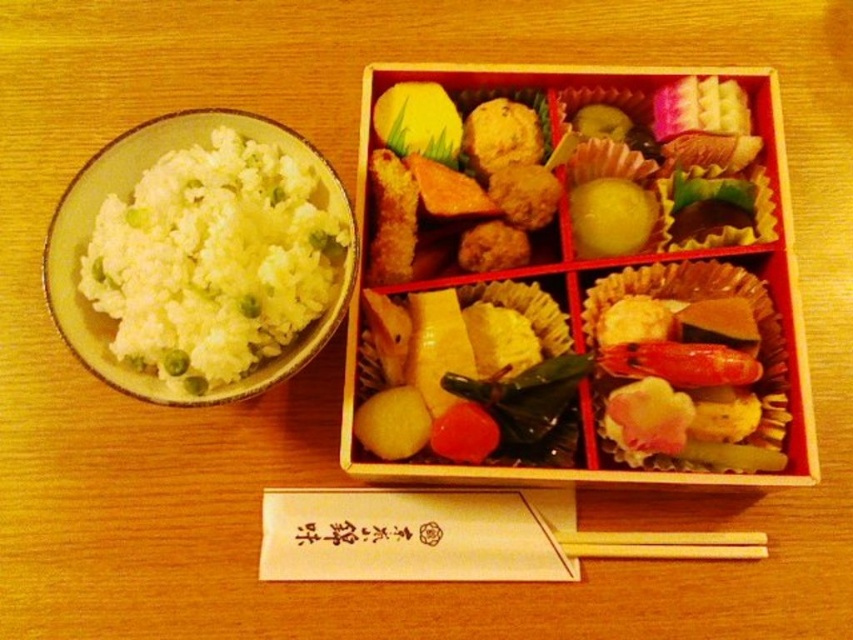
Between shiny golden rice ball at center and white matte rice at left, which one is positioned lower?

shiny golden rice ball at center

Can you confirm if shiny golden rice ball at center is positioned to the left of white matte rice at left?

Incorrect, shiny golden rice ball at center is not on the left side of white matte rice at left.

Locate an element on the screen. shiny golden rice ball at center is located at coordinates (577, 273).

Does point (514, 120) come closer to viewer compared to point (677, 531)?

That is False.

Measure the distance between shiny golden rice ball at center and camera.

shiny golden rice ball at center is 37.48 inches away from camera.

Between point (367, 176) and point (564, 540), which one is positioned in front?

Point (564, 540)

What are the coordinates of `shiny golden rice ball at center` in the screenshot? It's located at (577, 273).

Between yellow matte ball at center and wooden chopsticks at lower center, which one appears on the right side from the viewer's perspective?

Positioned to the right is wooden chopsticks at lower center.

Can you confirm if yellow matte ball at center is wider than wooden chopsticks at lower center?

Incorrect, yellow matte ball at center's width does not surpass wooden chopsticks at lower center's.

In order to click on yellow matte ball at center in this screenshot , I will do `click(611, 218)`.